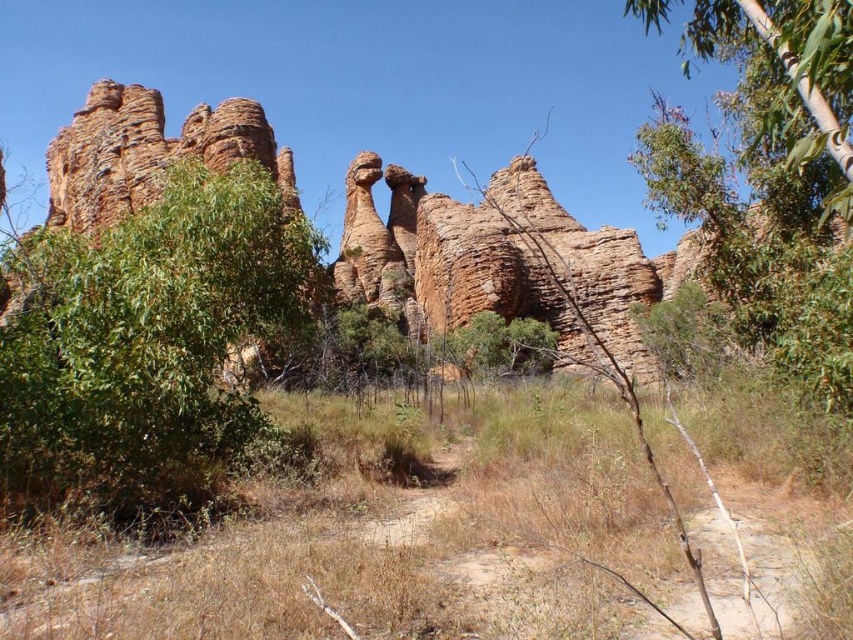
You are standing in the middle of the rugged landscape looking at the green leafy bush at left and the green leafy tree at upper right. Which one appears closer to the ground?

The green leafy bush at left appears closer to the ground since it is positioned below the green leafy tree at upper right.

You are standing in the rugged landscape and notice the dry grass at lower center and the green leafy bush at left. Which object is closer to your feet?

The dry grass at lower center is closer to your feet because it is located below the green leafy bush at left.